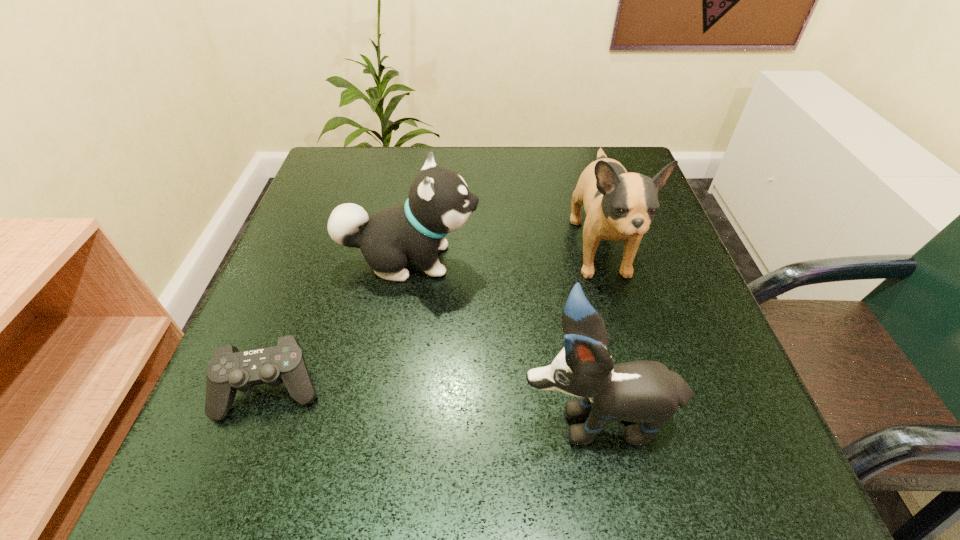
This screenshot has width=960, height=540. Identify the location of the nearest puppy. (646, 392).

You are a GUI agent. You are given a task and a screenshot of the screen. Output one action in this format:
    pyautogui.click(x=<x>, y=<y>)
    Task: Click on the leftmost puppy
    
    Given the screenshot: What is the action you would take?
    pyautogui.click(x=439, y=202)

Identify the location of the shortest object. The width and height of the screenshot is (960, 540). (229, 370).

Where is `vacant space positioned 0.340m on the front-facing side of the nearest puppy`? This screenshot has width=960, height=540. vacant space positioned 0.340m on the front-facing side of the nearest puppy is located at coordinates (279, 417).

This screenshot has width=960, height=540. I want to click on free space located 0.320m on the front-facing side of the nearest puppy, so click(294, 417).

Image resolution: width=960 pixels, height=540 pixels. Identify the location of free space located on the front-facing side of the nearest puppy. (272, 417).

Locate an element on the screen. The image size is (960, 540). vacant area situated at the face of the leftmost puppy is located at coordinates (677, 260).

This screenshot has width=960, height=540. What are the coordinates of `free spot located on the right of the control` in the screenshot? It's located at (557, 388).

The image size is (960, 540). I want to click on object that is at the near edge, so click(646, 392).

The image size is (960, 540). I want to click on puppy positioned at the left edge, so click(x=439, y=202).